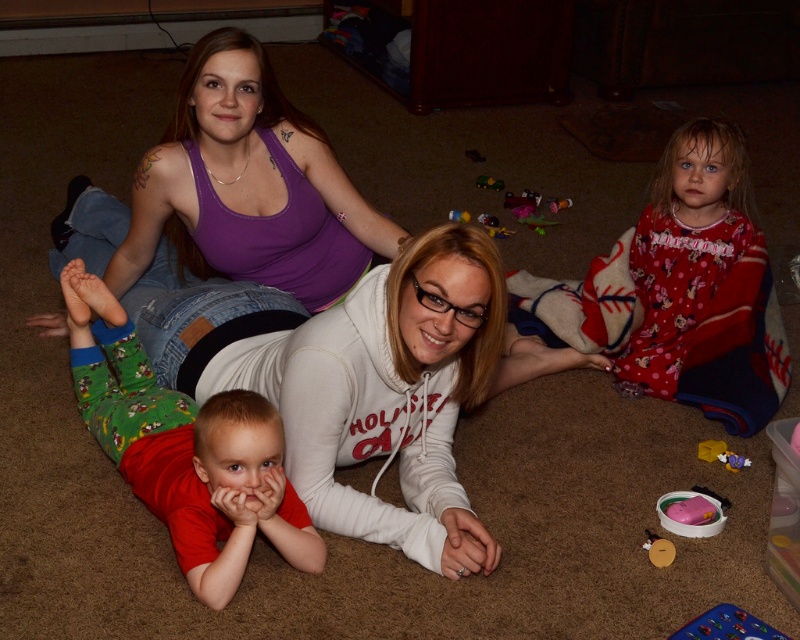
Can you confirm if yellow plush toy at lower right is shorter than green plastic toy car at center?

Indeed, yellow plush toy at lower right has a lesser height compared to green plastic toy car at center.

From the picture: Who is lower down, yellow plush toy at lower right or green plastic toy car at center?

Positioned lower is yellow plush toy at lower right.

Measure the distance between yellow plush toy at lower right and camera.

yellow plush toy at lower right is 7.34 feet from camera.

The width and height of the screenshot is (800, 640). I want to click on yellow plush toy at lower right, so click(x=721, y=454).

Can you confirm if green plastic toy car at center is smaller than rubberized plastic toy at center?

No, green plastic toy car at center is not smaller than rubberized plastic toy at center.

Who is taller, green plastic toy car at center or rubberized plastic toy at center?

With more height is green plastic toy car at center.

Does point (480, 173) lie behind point (454, 214)?

Yes.

Locate an element on the screen. This screenshot has height=640, width=800. green plastic toy car at center is located at coordinates (490, 182).

Can you confirm if white fleece hoodie at center is wider than yellow plush toy at lower right?

Correct, the width of white fleece hoodie at center exceeds that of yellow plush toy at lower right.

Can you confirm if white fleece hoodie at center is positioned to the left of yellow plush toy at lower right?

Yes, white fleece hoodie at center is to the left of yellow plush toy at lower right.

Is point (232, 264) in front of point (744, 458)?

No, it is behind (744, 458).

The image size is (800, 640). Find the location of `white fleece hoodie at center`. white fleece hoodie at center is located at coordinates (248, 188).